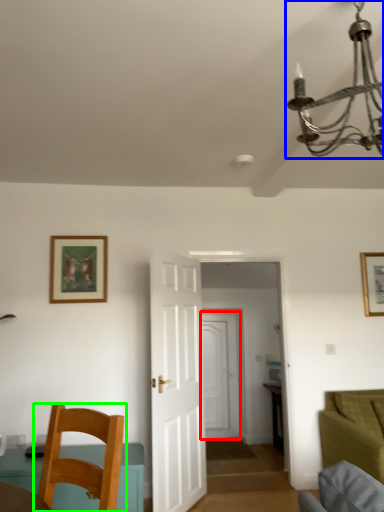
Question: Considering the real-world distances, which object is closest to door (highlighted by a red box)? light fixture (highlighted by a blue box) or chair (highlighted by a green box).

Choices:
 (A) light fixture
 (B) chair

Answer: (B)